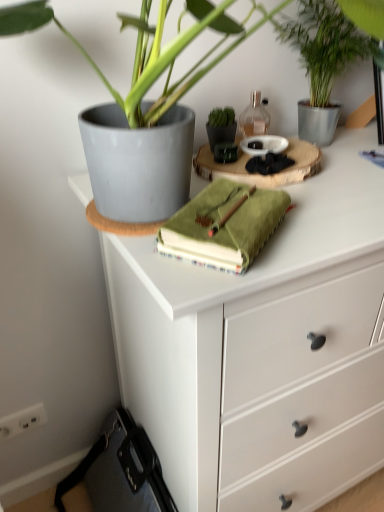
Locate an element on the screen. The height and width of the screenshot is (512, 384). vacant space to the right of green suede journal at center is located at coordinates (326, 225).